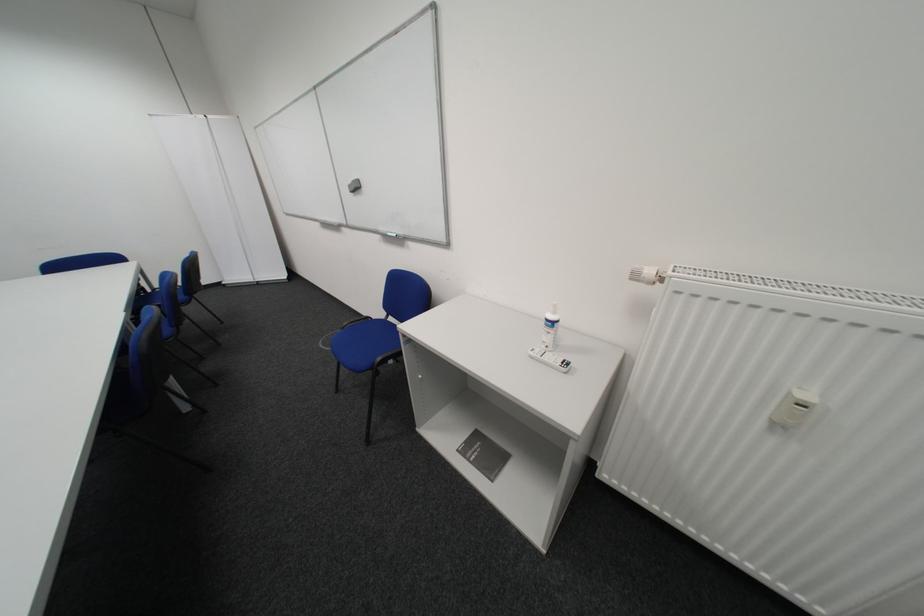
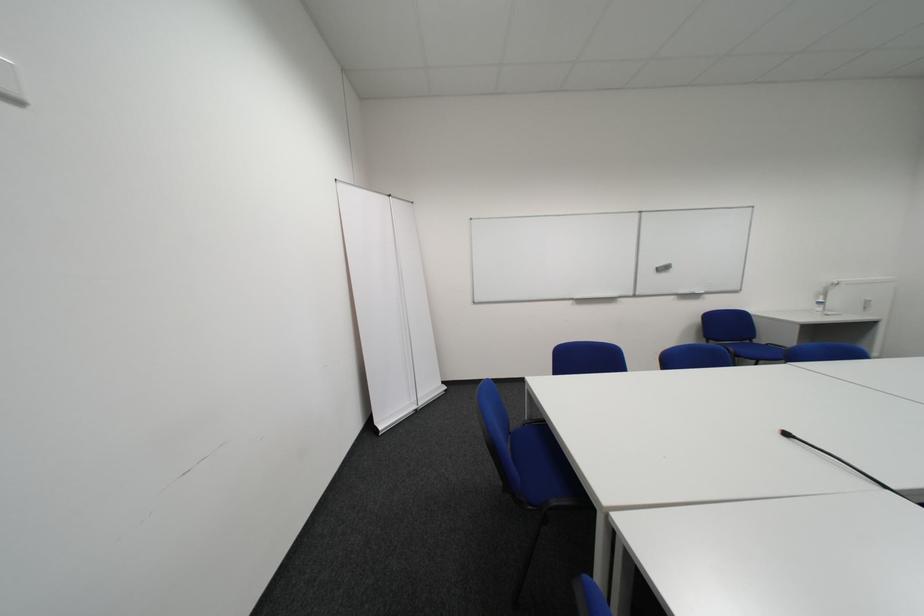
Find the pixel in the second image that matches (x=361, y=188) in the first image.

(669, 270)